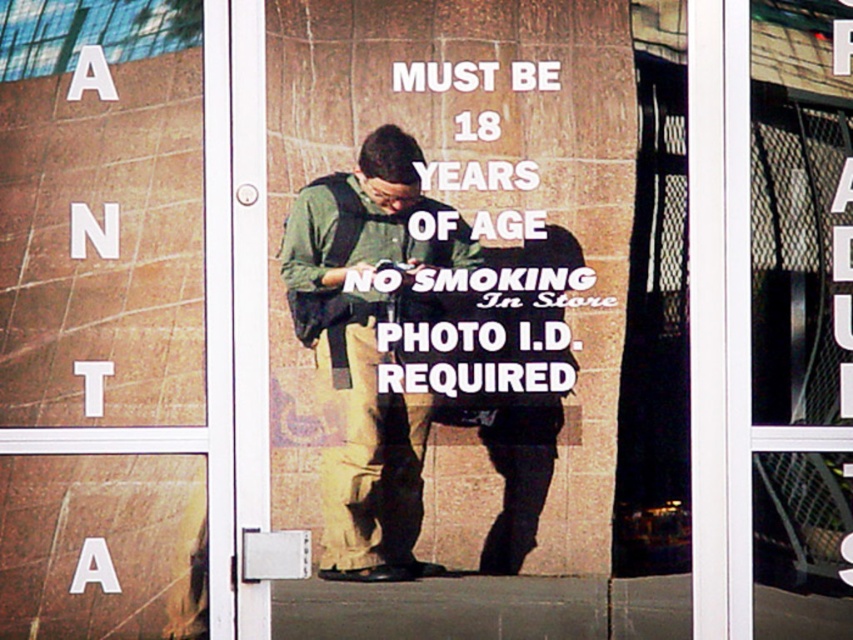
Who is higher up, matte brown sign at upper left or green fabric backpack at center?

matte brown sign at upper left is higher up.

Is point (47, 298) in front of point (383, 244)?

Yes, it is.

Identify the location of matte brown sign at upper left. The height and width of the screenshot is (640, 853). (102, 323).